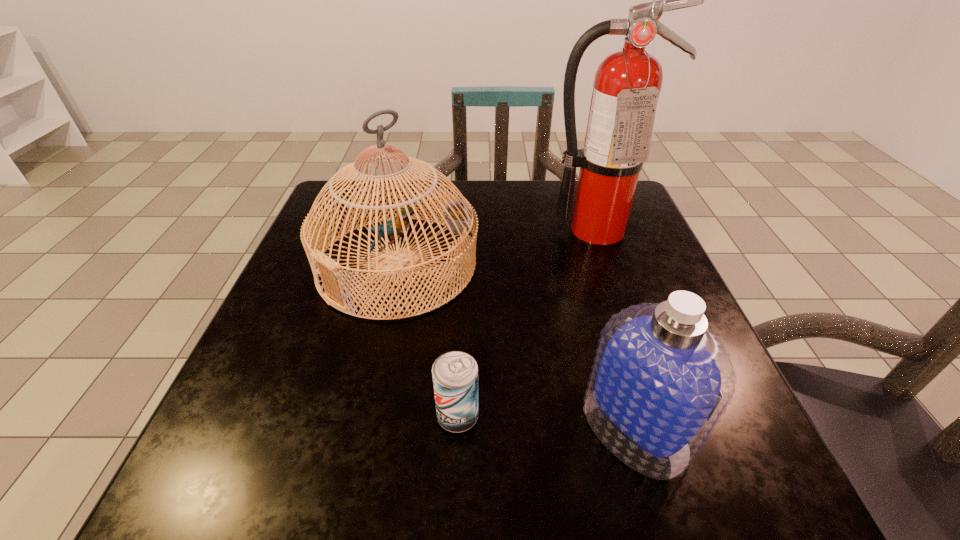
Locate an element on the screen. object that is at the near edge is located at coordinates (661, 380).

The width and height of the screenshot is (960, 540). Find the location of `object that is at the left edge`. object that is at the left edge is located at coordinates (457, 219).

What are the coordinates of `fire extinguisher at the right edge` in the screenshot? It's located at (627, 84).

Identify the location of cleansing agent located at the right edge. [661, 380].

Locate an element on the screen. The height and width of the screenshot is (540, 960). object that is at the far left corner is located at coordinates (457, 219).

This screenshot has height=540, width=960. In order to click on object that is positioned at the far right corner in this screenshot , I will do `click(627, 84)`.

The image size is (960, 540). Find the location of `object located in the near right corner section of the desktop`. object located in the near right corner section of the desktop is located at coordinates (661, 380).

Where is `vacant space at the far edge of the desktop`? vacant space at the far edge of the desktop is located at coordinates 478,181.

The width and height of the screenshot is (960, 540). In order to click on vacant space at the right edge of the desktop in this screenshot , I will do `click(747, 417)`.

Find the location of a particular element. vacant region at the near left corner of the desktop is located at coordinates (185, 478).